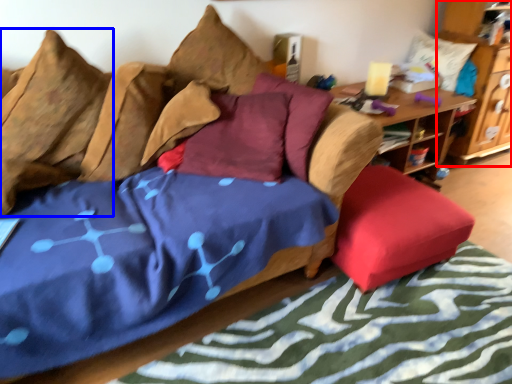
Question: Among these objects, which one is nearest to the camera, cabinetry (highlighted by a red box) or pillow (highlighted by a blue box)?

Choices:
 (A) cabinetry
 (B) pillow

Answer: (B)